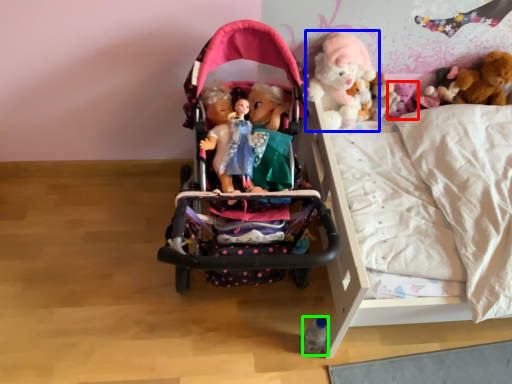
Question: Which object is positioned closest to toy (highlighted by a red box)? Select from toy (highlighted by a blue box) and toy (highlighted by a green box).

Choices:
 (A) toy
 (B) toy

Answer: (A)